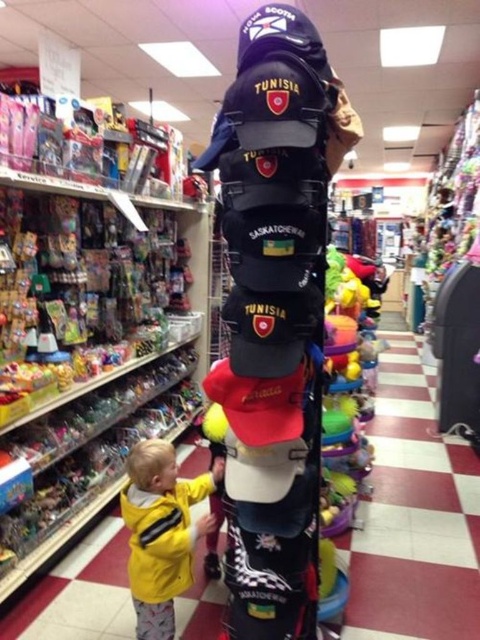
Question: Which point is closer to the camera?

Choices:
 (A) (433, 566)
 (B) (216, 474)

Answer: (B)

Question: Among these objects, which one is farthest from the camera?

Choices:
 (A) yellow matte jacket at lower left
 (B) smooth plastic toys at center

Answer: (B)

Question: Is smooth plastic toys at center thinner than yellow matte jacket at lower left?

Choices:
 (A) yes
 (B) no

Answer: (B)

Question: Observing the image, what is the correct spatial positioning of smooth plastic toys at center in reference to yellow matte jacket at lower left?

Choices:
 (A) above
 (B) below

Answer: (B)

Question: Is smooth plastic toys at center further to the viewer compared to yellow matte jacket at lower left?

Choices:
 (A) no
 (B) yes

Answer: (B)